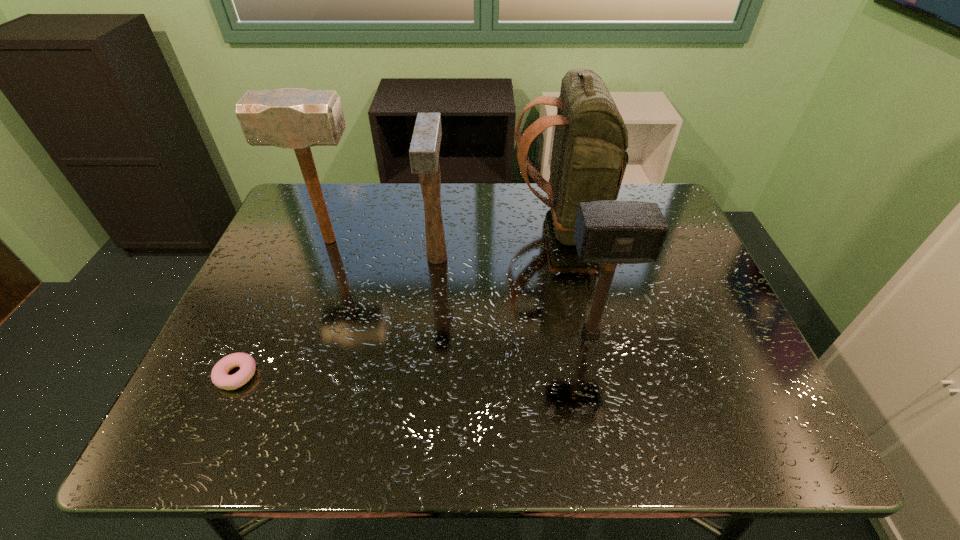
Where is `vacant point that satisfies the following two spatial constraints: 1. on the back of the backpack; 2. on the back side of the rightmost mallet`? vacant point that satisfies the following two spatial constraints: 1. on the back of the backpack; 2. on the back side of the rightmost mallet is located at coordinates (587, 334).

At what (x,y) coordinates should I click in order to perform the action: click on free point that satisfies the following two spatial constraints: 1. on the striking face of the leftmost mallet; 2. on the left side of the third object from left to right. Please return your answer as a coordinate pair (x, y). This screenshot has width=960, height=540. Looking at the image, I should click on (324, 258).

I want to click on free point that satisfies the following two spatial constraints: 1. on the striking face of the leftmost mallet; 2. on the left side of the third object from left to right, so click(x=324, y=258).

Find the location of `free space that satisfies the following two spatial constraints: 1. on the back side of the doughnut; 2. on the left side of the second mallet from right to left`. free space that satisfies the following two spatial constraints: 1. on the back side of the doughnut; 2. on the left side of the second mallet from right to left is located at coordinates (290, 258).

Where is `free region that satisfies the following two spatial constraints: 1. on the back of the fourth farthest object; 2. on the left side of the backpack`? The image size is (960, 540). free region that satisfies the following two spatial constraints: 1. on the back of the fourth farthest object; 2. on the left side of the backpack is located at coordinates (587, 334).